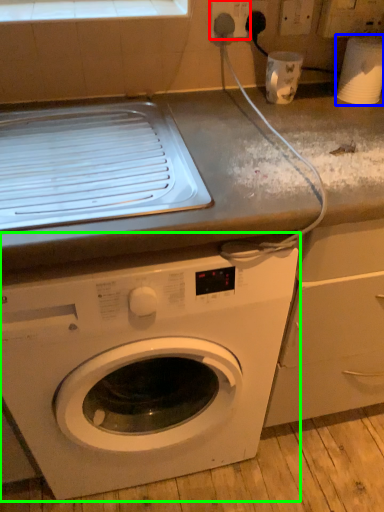
Question: Estimate the real-world distances between objects in this image. Which object is farther from electric outlet (highlighted by a red box), appliance (highlighted by a blue box) or washing machine (highlighted by a green box)?

Choices:
 (A) appliance
 (B) washing machine

Answer: (B)